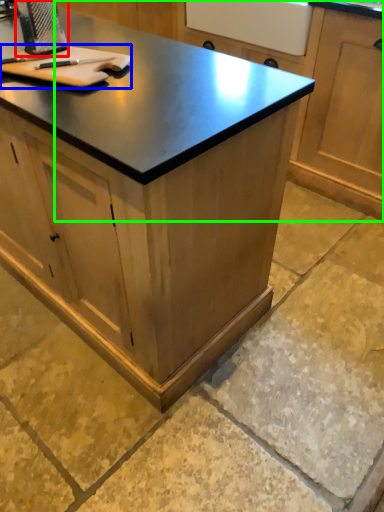
Question: Which is nearer to the appliance (highlighted by a red box)? cutting board (highlighted by a blue box) or cabinetry (highlighted by a green box).

Choices:
 (A) cutting board
 (B) cabinetry

Answer: (A)